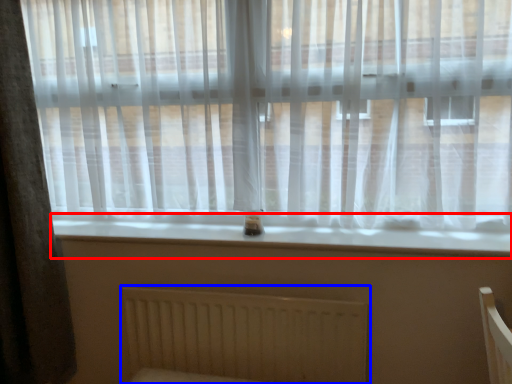
Question: Among these objects, which one is nearest to the camera, window sill (highlighted by a red box) or radiator (highlighted by a blue box)?

Choices:
 (A) window sill
 (B) radiator

Answer: (A)